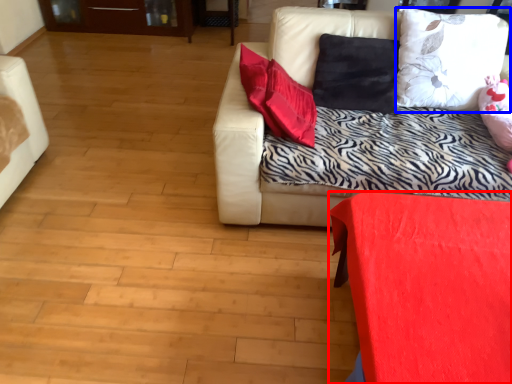
Question: Which object appears farthest to the camera in this image, furniture (highlighted by a red box) or pillow (highlighted by a blue box)?

Choices:
 (A) furniture
 (B) pillow

Answer: (B)